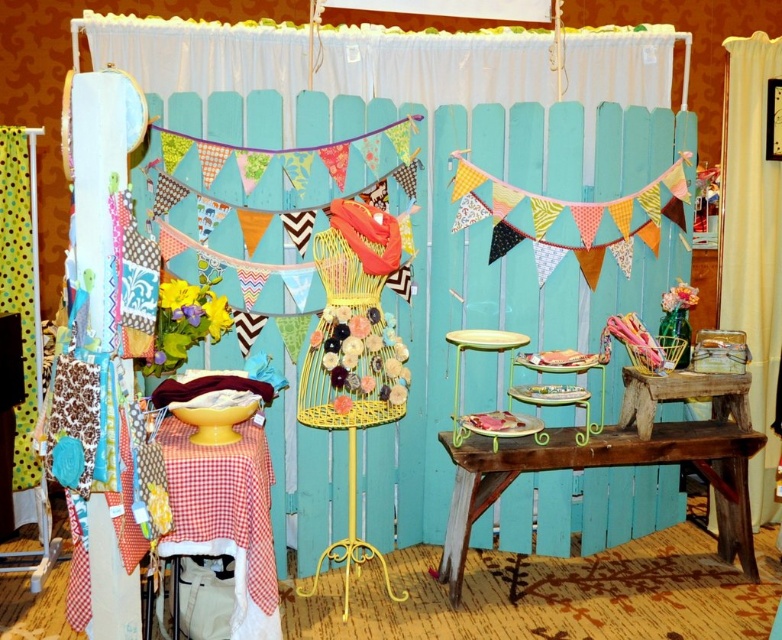
Question: Does rustic wood table at center appear under rustic wood table at lower right?

Choices:
 (A) no
 (B) yes

Answer: (B)

Question: Is rustic wood table at center below rustic wood table at lower right?

Choices:
 (A) yes
 (B) no

Answer: (A)

Question: Which of the following is the farthest from the observer?

Choices:
 (A) rustic wood table at center
 (B) rustic wood table at lower right

Answer: (B)

Question: Can you confirm if rustic wood table at center is wider than rustic wood table at lower right?

Choices:
 (A) no
 (B) yes

Answer: (B)